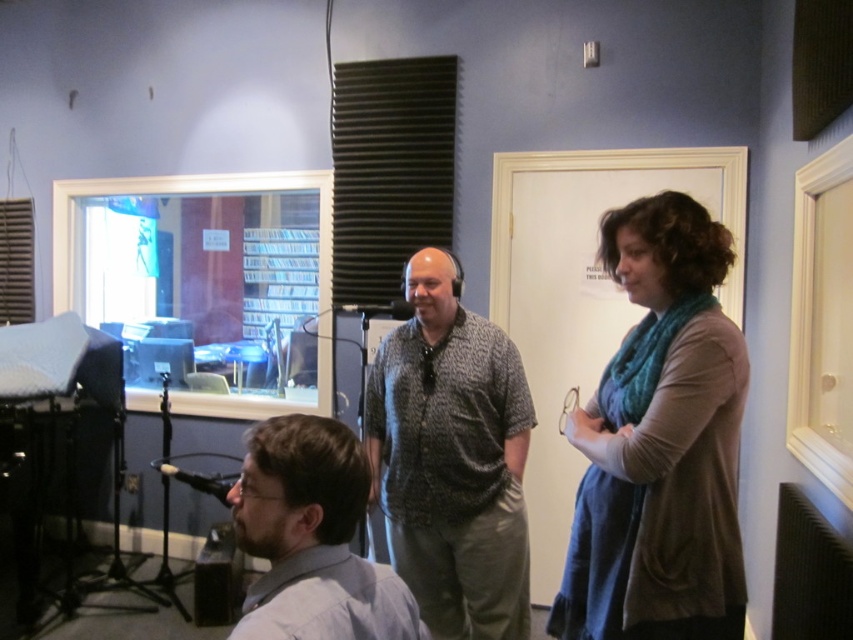
Is patterned fabric shirt at center taller than gray shirt at lower left?

Yes, patterned fabric shirt at center is taller than gray shirt at lower left.

Does point (495, 541) come closer to viewer compared to point (314, 589)?

No, it is behind (314, 589).

This screenshot has height=640, width=853. Find the location of `patterned fabric shirt at center`. patterned fabric shirt at center is located at coordinates (451, 458).

Between point (669, 522) and point (479, 420), which one is positioned behind?

Positioned behind is point (479, 420).

Is teal knit scarf at right to the right of patterned fabric shirt at center from the viewer's perspective?

Indeed, teal knit scarf at right is positioned on the right side of patterned fabric shirt at center.

Which is behind, point (572, 589) or point (431, 339)?

Point (431, 339)

Identify the location of teal knit scarf at right. This screenshot has width=853, height=640. (660, 442).

Between point (583, 497) and point (294, 586), which one is positioned in front?

Positioned in front is point (294, 586).

Who is more distant from viewer, (646, 461) or (312, 580)?

Positioned behind is point (646, 461).

The image size is (853, 640). Identify the location of teal knit scarf at right. (660, 442).